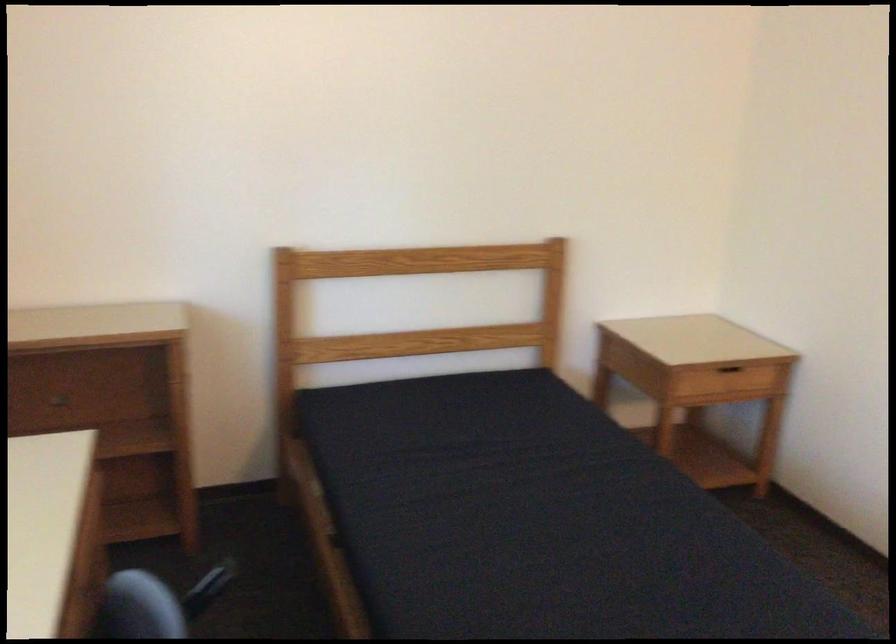
The height and width of the screenshot is (644, 896). Identify the location of drawer handle. (727, 368).